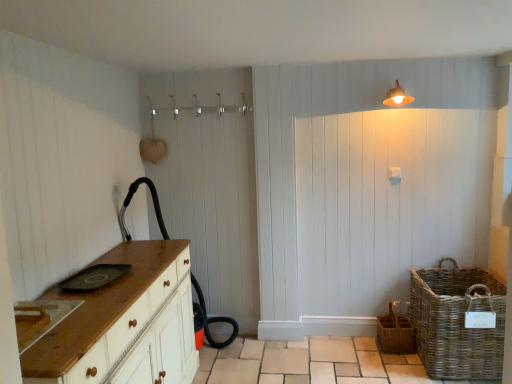
Question: Based on their positions, is woven wicker basket at lower right, acting as the 2th basket starting from the right, located to the left or right of woven brown basket at lower right, which is counted as the 1th basket, starting from the right?

Choices:
 (A) left
 (B) right

Answer: (A)

Question: Relative to woven brown basket at lower right, which is counted as the 1th basket, starting from the right, is woven wicker basket at lower right, acting as the 2th basket starting from the right, in front or behind?

Choices:
 (A) behind
 (B) front

Answer: (A)

Question: Considering the real-world distances, which object is closest to the wooden chest of drawers at left?

Choices:
 (A) woven brown basket at lower right, which is counted as the 1th basket, starting from the right
 (B) woven wicker basket at lower right, acting as the 2th basket starting from the right
 (C) matte white light fixture at upper right

Answer: (B)

Question: Which object is the farthest from the wooden chest of drawers at left?

Choices:
 (A) woven wicker basket at lower right, acting as the 2th basket starting from the right
 (B) matte white light fixture at upper right
 (C) woven brown basket at lower right, the 2th basket when ordered from left to right

Answer: (B)